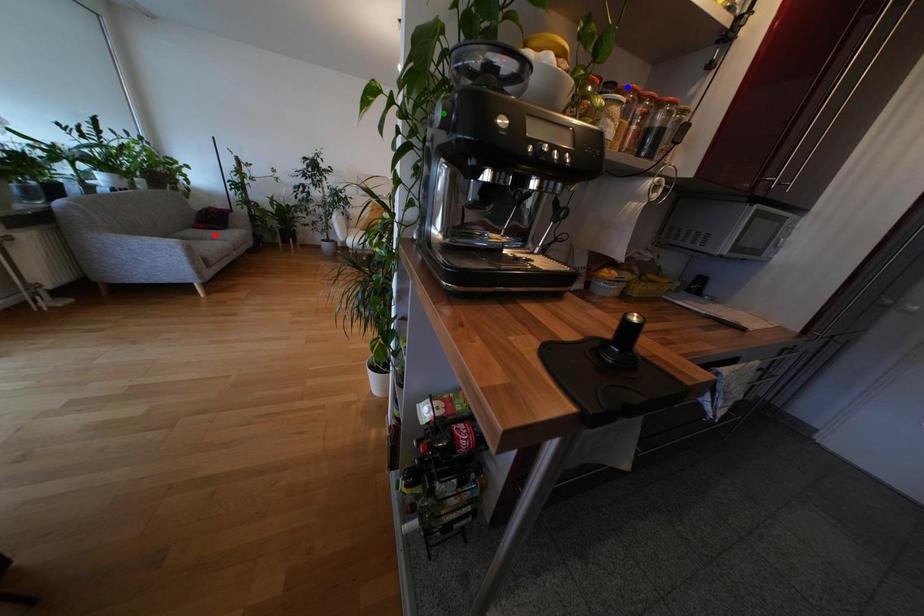
Order these from farthest to nearest:
A) blue point
B) green point
C) red point

red point, blue point, green point